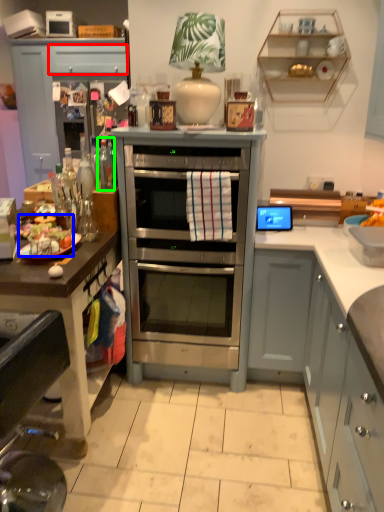
Question: Which object is positioned farthest from drawer (highlighted by a red box)? Select from food (highlighted by a blue box) and bottle (highlighted by a green box).

Choices:
 (A) food
 (B) bottle

Answer: (A)